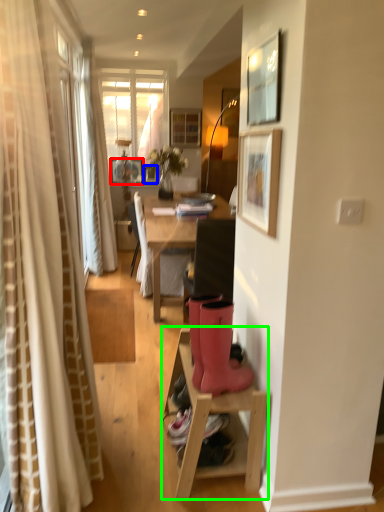
Question: Considering the real-world distances, which object is closest to picture frame (highlighted by a red box)? picture frame (highlighted by a blue box) or table (highlighted by a green box).

Choices:
 (A) picture frame
 (B) table

Answer: (A)